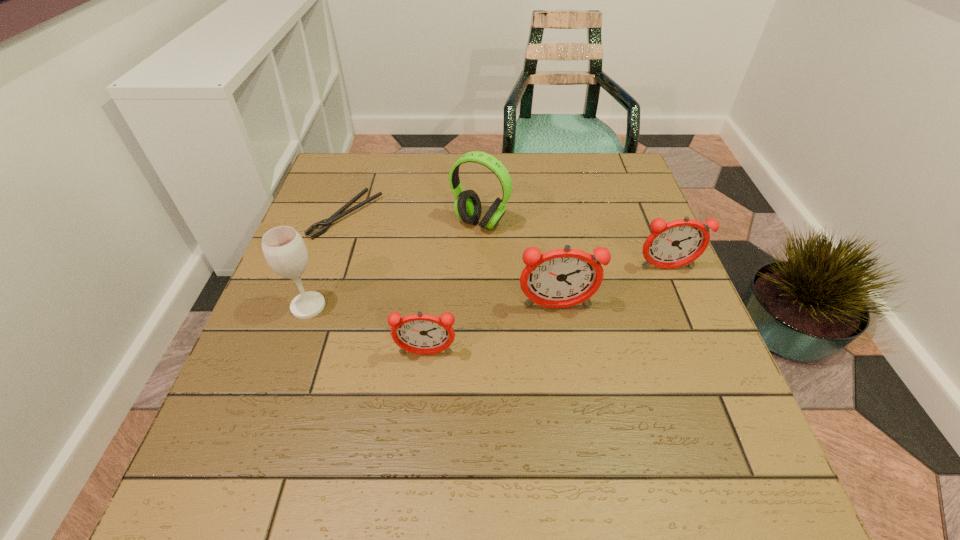
The alarm clocks are evenly distributed in the image. To maintain this, where would you place another alarm clock on the left? Please point to a free space. Please provide its 2D coordinates. Your answer should be formatted as a tuple, i.e. [(x, y)], where the tuple contains the x and y coordinates of a point satisfying the conditions above.

[(268, 410)]